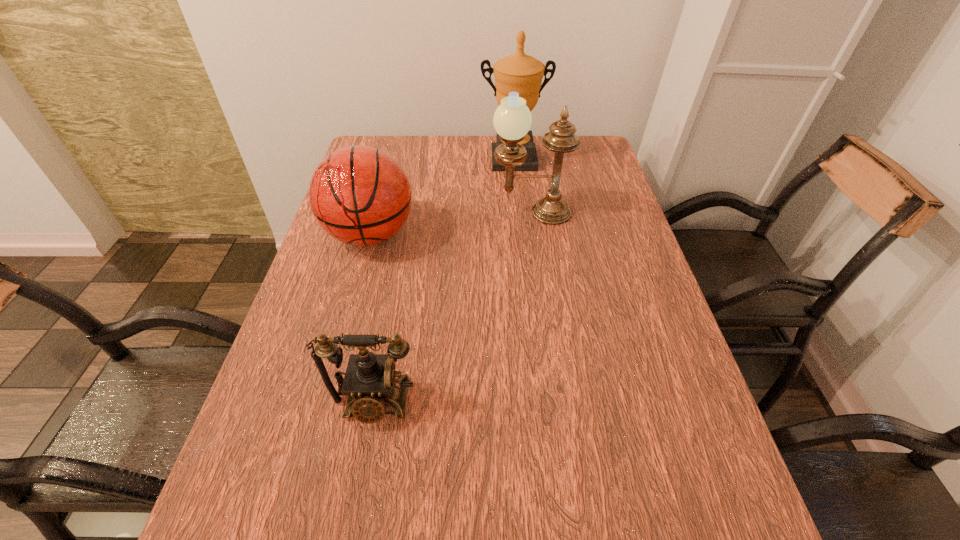
Where is `basketball located in the left edge section of the desktop`? The image size is (960, 540). basketball located in the left edge section of the desktop is located at coordinates (361, 196).

Where is `telephone at the left edge`? telephone at the left edge is located at coordinates (370, 384).

Find the location of a particular element. Image resolution: width=960 pixels, height=540 pixels. object at the right edge is located at coordinates (512, 120).

Locate an element on the screen. The width and height of the screenshot is (960, 540). vacant space at the far edge of the desktop is located at coordinates (539, 148).

You are a GUI agent. You are given a task and a screenshot of the screen. Output one action in this format:
    pyautogui.click(x=<x>, y=<y>)
    Task: Click on the vacant space at the left edge of the desktop
    This screenshot has width=960, height=540.
    Given the screenshot: What is the action you would take?
    pyautogui.click(x=358, y=331)

Identify the location of vacant space at the right edge of the desktop. (675, 421).

Image resolution: width=960 pixels, height=540 pixels. I want to click on vacant area at the far right corner of the desktop, so click(x=588, y=137).

I want to click on unoccupied position between the third tallest object and the shortest object, so click(372, 319).

Locate an element on the screen. empty space between the farthest object and the basketball is located at coordinates pyautogui.click(x=442, y=197).

I want to click on blank region between the second shortest object and the oil lamp, so click(x=450, y=224).